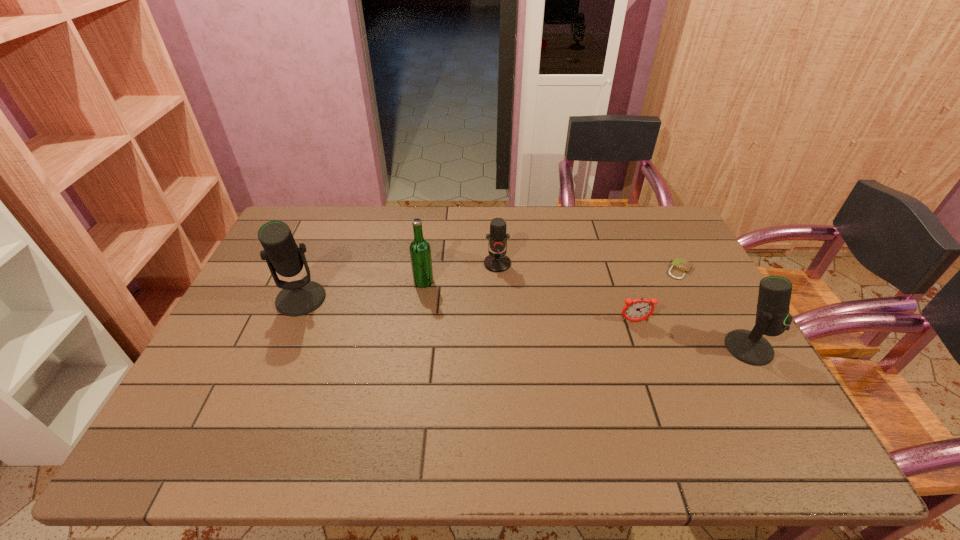
Where is `free spot that satisfies the following two spatial constraints: 1. on the side of the third object from left to right with the red ring; 2. on the left side of the padlock`? free spot that satisfies the following two spatial constraints: 1. on the side of the third object from left to right with the red ring; 2. on the left side of the padlock is located at coordinates (497, 270).